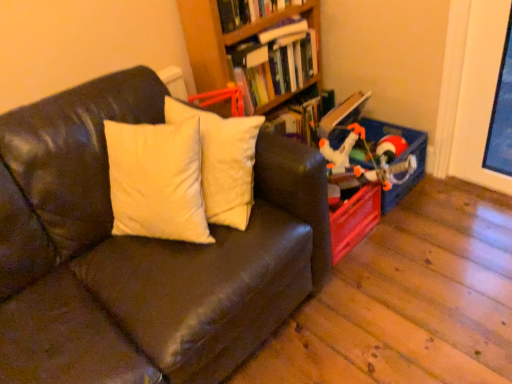
Question: Considering the positions of leather couch at left and matte plastic toy at right in the image, is leather couch at left wider or thinner than matte plastic toy at right?

Choices:
 (A) wide
 (B) thin

Answer: (A)

Question: From a real-world perspective, relative to matte plastic toy at right, is leather couch at left vertically above or below?

Choices:
 (A) below
 (B) above

Answer: (B)

Question: Which object is positioned closest to the hardcover book at upper center, the first book when ordered from top to bottom?

Choices:
 (A) wooden bookshelf at upper center
 (B) matte plastic toy at right
 (C) hardcover book at upper center, the second book from the top
 (D) leather couch at left

Answer: (A)

Question: Which of these objects is positioned farthest from the matte plastic toy at right?

Choices:
 (A) leather couch at left
 (B) hardcover book at upper center, the first book when ordered from top to bottom
 (C) wooden bookshelf at upper center
 (D) hardcover book at upper center, the second book from the top

Answer: (A)